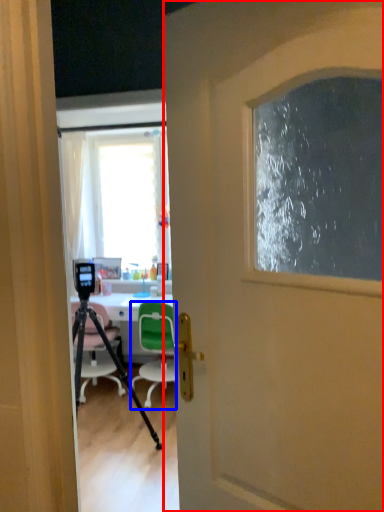
Question: Which of the following is the closest to the observer, door (highlighted by a red box) or chair (highlighted by a blue box)?

Choices:
 (A) door
 (B) chair

Answer: (A)